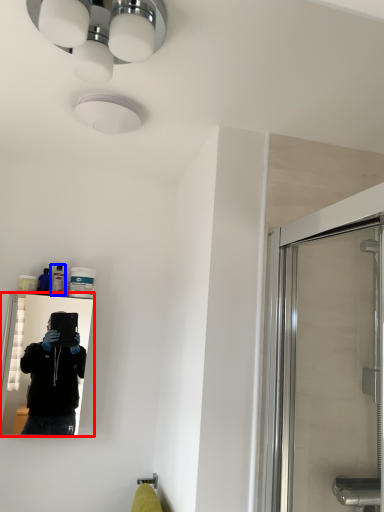
Question: Which point is further to the camera, mirror (highlighted by a red box) or toiletry (highlighted by a blue box)?

Choices:
 (A) mirror
 (B) toiletry

Answer: (B)